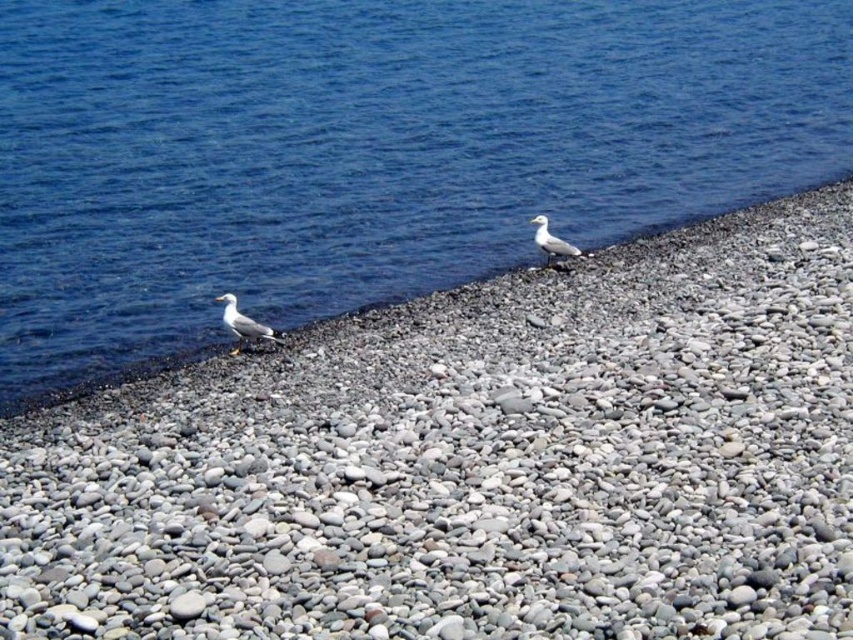
You are standing on the beach and want to place a small seashell between the gray pebbles at center and the blue water at upper left. Which object should you place the seashell closer to if you want it to be more visible against the larger background?

The seashell should be placed closer to the blue water at upper left because it is larger than the gray pebbles at center, making the seashell more visible against its surface.

You are a photographer aiming to capture a closeup of the gray pebbles at center. You are currently standing behind the white feathered bird at center. Can you take the photo without moving the bird?

The gray pebbles at center is below the white feathered bird at center, so you can take the photo by positioning yourself lower to avoid blocking the view of the pebbles.

You are standing on the pebble beach and see the blue water at upper left and the white matte seagull at lower left. Which object is positioned further to the left?

The blue water at upper left is positioned to the left of the white matte seagull at lower left, so it is further to the left.